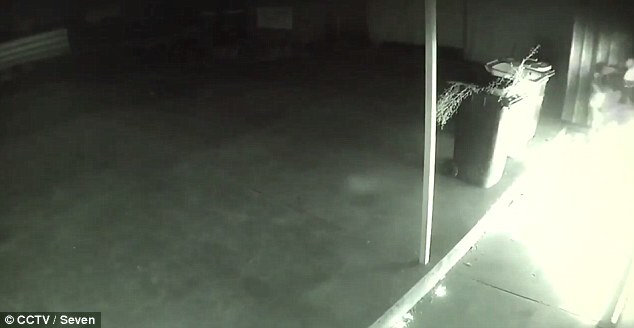
Identify the location of pillar. (428, 71).